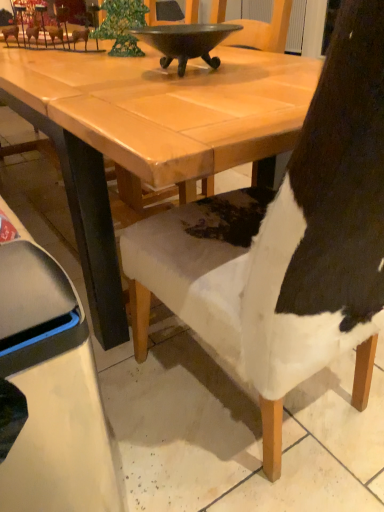
Find the location of `free space to the back side of shiny dark metal bowl at upper center`. free space to the back side of shiny dark metal bowl at upper center is located at coordinates 213,54.